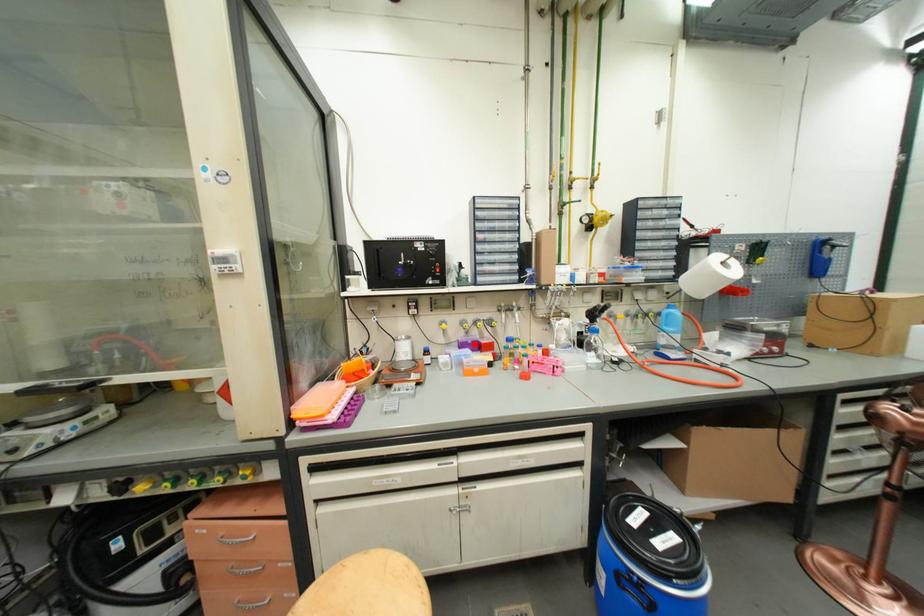
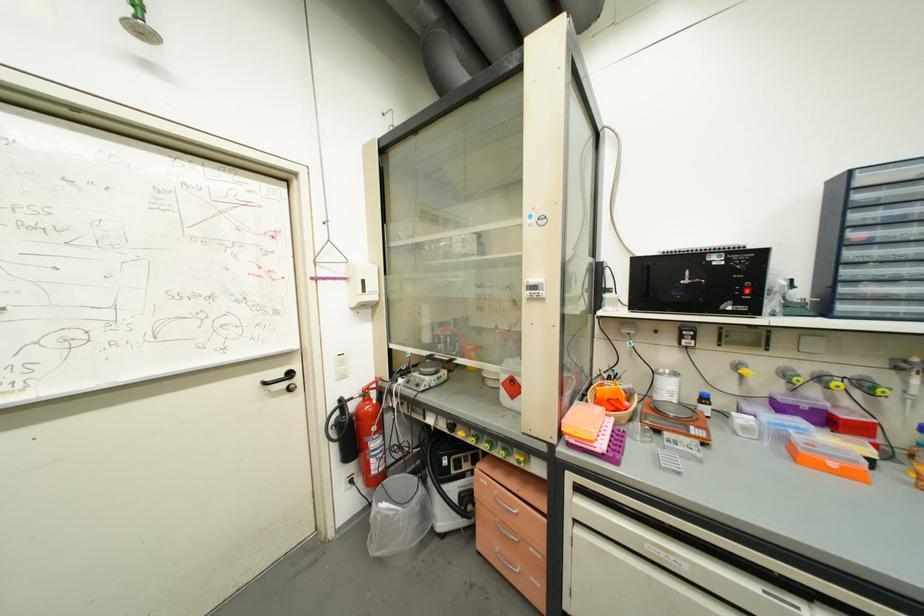
Where in the second image is the point corresponding to the highlighted location from the first image?

(807, 410)